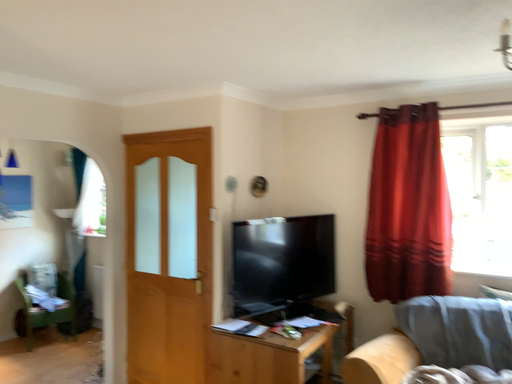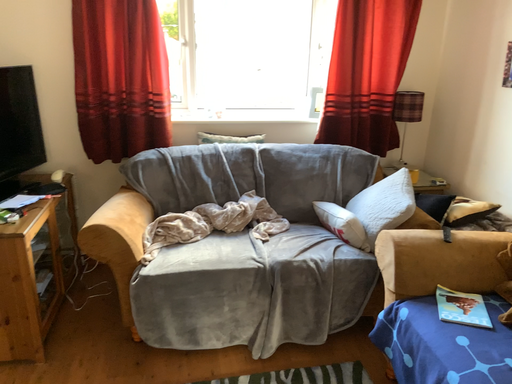
Question: Which way did the camera rotate in the video?

Choices:
 (A) rotated left
 (B) rotated right

Answer: (B)